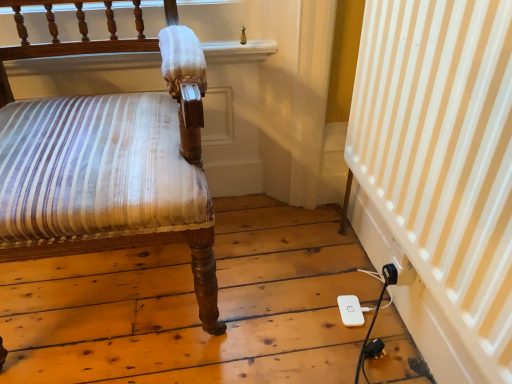
Find the location of `free space to the back side of white plastic ipod at lower right`. free space to the back side of white plastic ipod at lower right is located at coordinates (335, 264).